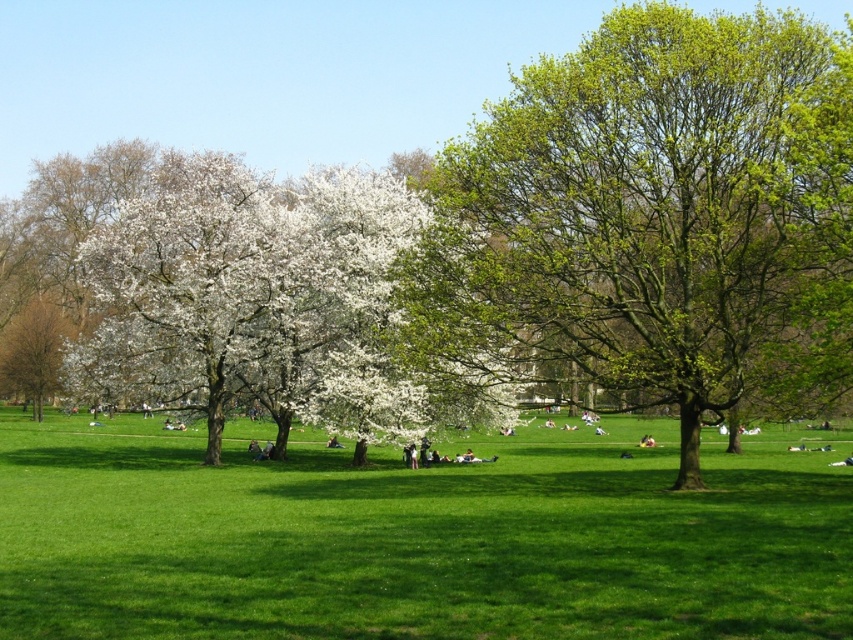
Is green leafy tree at center shorter than smooth white blossoms at left?

In fact, green leafy tree at center may be taller than smooth white blossoms at left.

Does green leafy tree at center appear over smooth white blossoms at left?

Yes, green leafy tree at center is above smooth white blossoms at left.

Does point (573, 61) come closer to viewer compared to point (73, 333)?

Yes, it is in front of point (73, 333).

What are the coordinates of `green leafy tree at center` in the screenshot? It's located at (653, 218).

Is the position of green grassy field at center less distant than that of green leafy tree at center?

Yes.

Who is lower down, green grassy field at center or green leafy tree at center?

Positioned lower is green grassy field at center.

Is point (117, 436) farther from camera compared to point (546, 196)?

Yes, point (117, 436) is farther from viewer.

You are a GUI agent. You are given a task and a screenshot of the screen. Output one action in this format:
    pyautogui.click(x=<x>, y=<y>)
    Task: Click on the green grassy field at center
    This screenshot has width=853, height=640.
    Given the screenshot: What is the action you would take?
    pyautogui.click(x=416, y=538)

Is green grassy field at center above smooth white blossoms at left?

Actually, green grassy field at center is below smooth white blossoms at left.

Is green grassy field at center smaller than smooth white blossoms at left?

No, green grassy field at center is not smaller than smooth white blossoms at left.

The height and width of the screenshot is (640, 853). I want to click on green grassy field at center, so click(x=416, y=538).